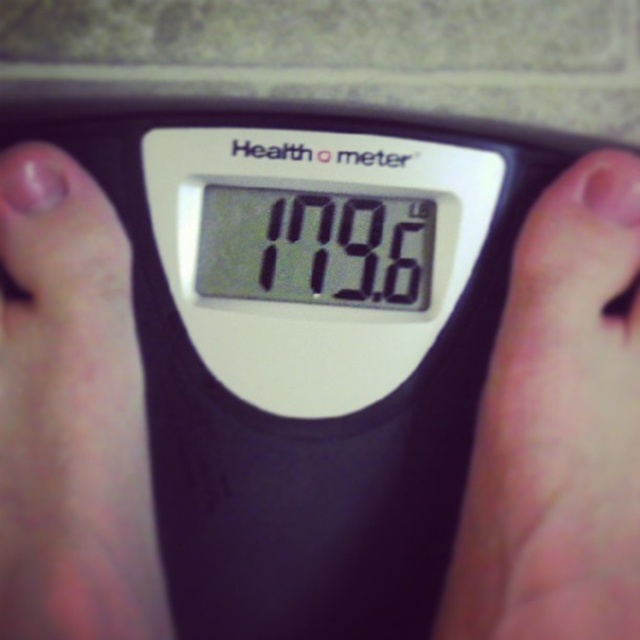
You are a dermatologist examining a patient. You notice two areas of skin on their foot visible in the image. The pale skin at center and pink skin at left. Which area is closer to the toes?

The pale skin at center is shorter than pink skin at left, so the pink skin at left is closer to the toes.

You are a fitness trainer assessing a client who is standing on a Health o meter scale. You see the pink skin at left and the black digital display at center. Which object is positioned to the left of the other?

The pink skin at left is positioned to the left of the black digital display at center.

You are a physical therapist assessing a patient using a digital scale. You notice the pale skin at center and the black digital display at center. Which object is closer to you according to the image?

The pale skin at center is closer to you as it is in front of the black digital display at center in the image.